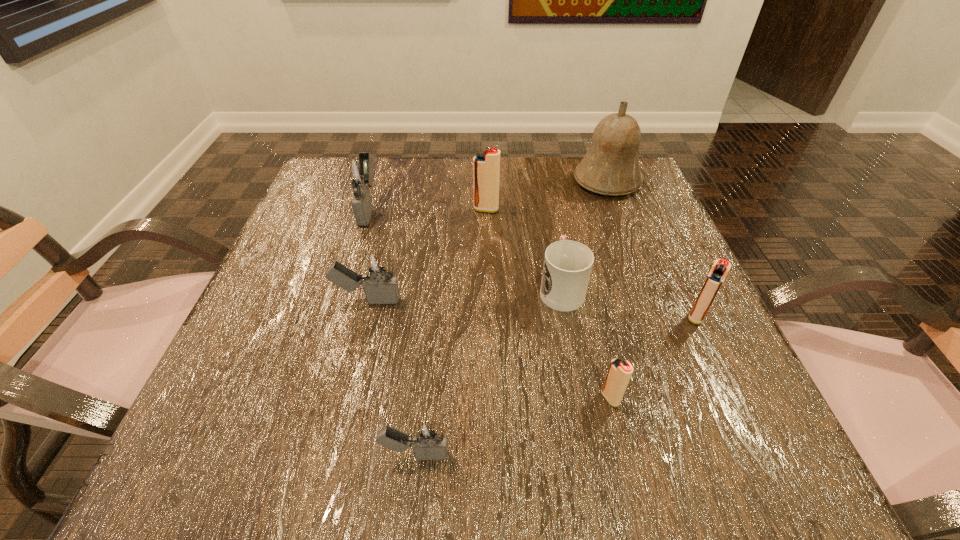
Where is `vacant space located 0.350m on the back of the fifth igniter from left to right`? The width and height of the screenshot is (960, 540). vacant space located 0.350m on the back of the fifth igniter from left to right is located at coordinates (572, 240).

Image resolution: width=960 pixels, height=540 pixels. In order to click on vacant space located on the right of the rightmost gray igniter in this screenshot , I will do `click(696, 455)`.

Find the location of `bell located in the far edge section of the desktop`. bell located in the far edge section of the desktop is located at coordinates (610, 167).

Locate an element on the screen. Image resolution: width=960 pixels, height=540 pixels. object located in the near edge section of the desktop is located at coordinates (428, 439).

You are a GUI agent. You are given a task and a screenshot of the screen. Output one action in this format:
    pyautogui.click(x=<x>, y=<y>)
    Task: Click on the bell that is at the right edge
    This screenshot has height=540, width=960.
    Given the screenshot: What is the action you would take?
    pyautogui.click(x=610, y=167)

Identify the location of igniter that is at the right edge. (721, 267).

You are a GUI agent. You are given a task and a screenshot of the screen. Output one action in this format:
    pyautogui.click(x=<x>, y=<y>)
    Task: Click on the object that is positioned at the far left corner
    This screenshot has height=540, width=960.
    Given the screenshot: What is the action you would take?
    pyautogui.click(x=356, y=172)

This screenshot has width=960, height=540. Find the location of `object present at the far right corner`. object present at the far right corner is located at coordinates (610, 167).

In the image, there is a desktop. At what (x,y) coordinates should I click in order to perform the action: click on vacant space at the far edge. Please return your answer as a coordinate pair (x, y). The image size is (960, 540). Looking at the image, I should click on (452, 180).

In the image, there is a desktop. At what (x,y) coordinates should I click in order to perform the action: click on vacant space at the left edge. Please return your answer as a coordinate pair (x, y). This screenshot has height=540, width=960. Looking at the image, I should click on (270, 349).